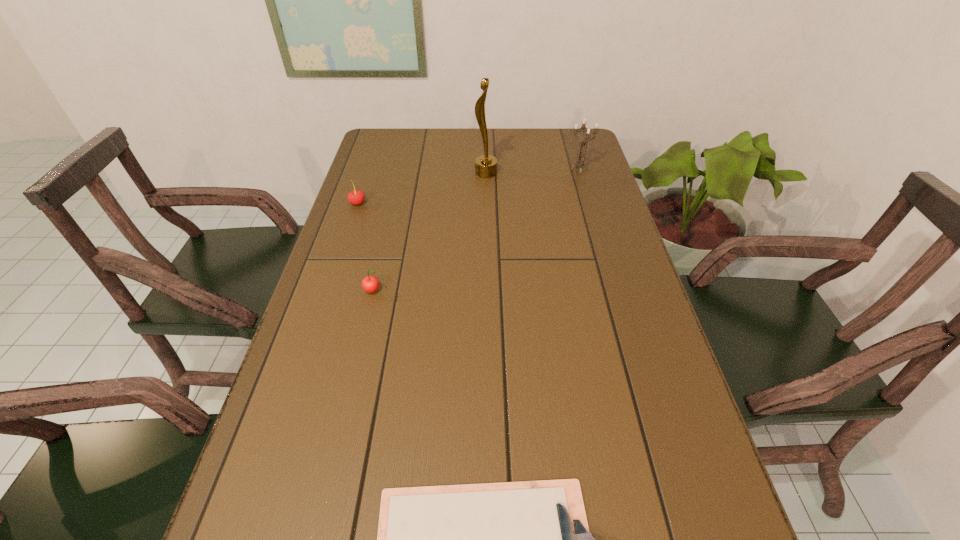
This screenshot has height=540, width=960. In order to click on blank region between the left cherry and the award in this screenshot , I will do `click(421, 188)`.

Find the location of `unoccupied position between the tallest object and the candle holder`. unoccupied position between the tallest object and the candle holder is located at coordinates (533, 171).

Where is `free point between the tallest object and the right cherry`? This screenshot has height=540, width=960. free point between the tallest object and the right cherry is located at coordinates (429, 232).

The width and height of the screenshot is (960, 540). What are the coordinates of `unoccupied area between the tallest object and the leftmost object` in the screenshot? It's located at pos(421,188).

Select which object appears as the third closest to the award. Please provide its 2D coordinates. Your answer should be formatted as a tuple, i.e. [(x, y)], where the tuple contains the x and y coordinates of a point satisfying the conditions above.

[(370, 284)]

Choose which object is the second nearest neighbor to the second object from left to right. Please provide its 2D coordinates. Your answer should be formatted as a tuple, i.e. [(x, y)], where the tuple contains the x and y coordinates of a point satisfying the conditions above.

[(530, 539)]

Where is `free region that satisfies the following two spatial constraints: 1. on the front side of the fourth shortest object; 2. on the front-facing side of the tallest object`? This screenshot has width=960, height=540. free region that satisfies the following two spatial constraints: 1. on the front side of the fourth shortest object; 2. on the front-facing side of the tallest object is located at coordinates pos(580,173).